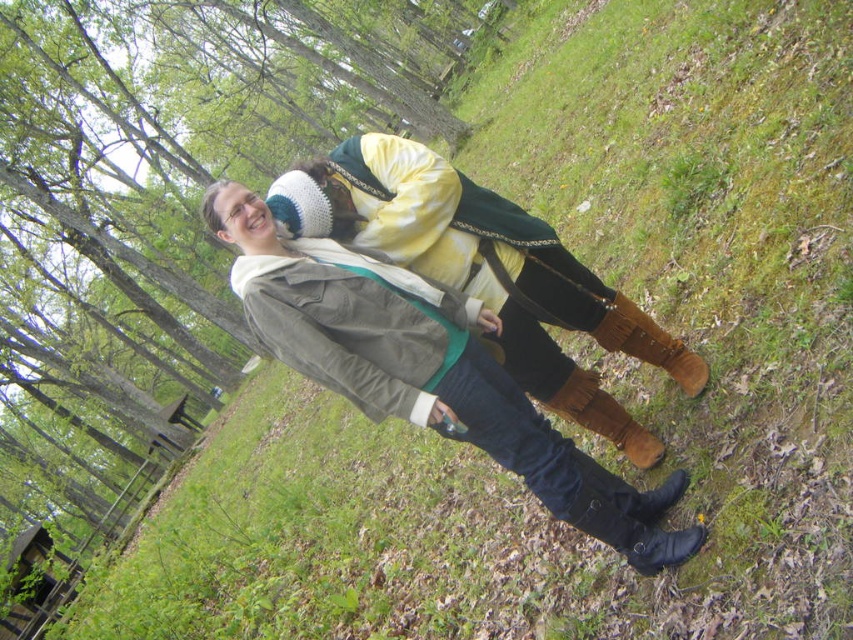
Question: Which point appears closest to the camera in this image?

Choices:
 (A) (625, 340)
 (B) (650, 465)
 (C) (410, 328)

Answer: (C)

Question: Can you confirm if brown suede boot at lower center is positioned above brown suede boot at lower right?

Choices:
 (A) yes
 (B) no

Answer: (A)

Question: Which point is closer to the camera?

Choices:
 (A) [567, 486]
 (B) [587, 385]

Answer: (A)

Question: Based on their relative distances, which object is nearer to the matte brown boots at center?

Choices:
 (A) brown suede boot at lower right
 (B) brown suede boot at lower center

Answer: (A)

Question: Is matte brown boots at center behind brown suede boot at lower right?

Choices:
 (A) yes
 (B) no

Answer: (B)

Question: Considering the relative positions of brown suede boot at lower center and brown suede boot at lower right in the image provided, where is brown suede boot at lower center located with respect to brown suede boot at lower right?

Choices:
 (A) right
 (B) left

Answer: (A)